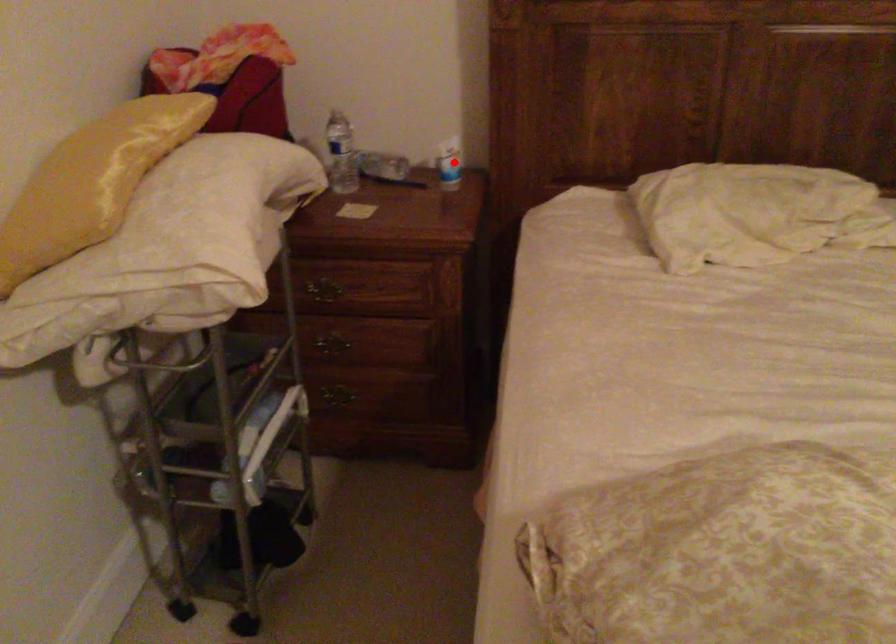
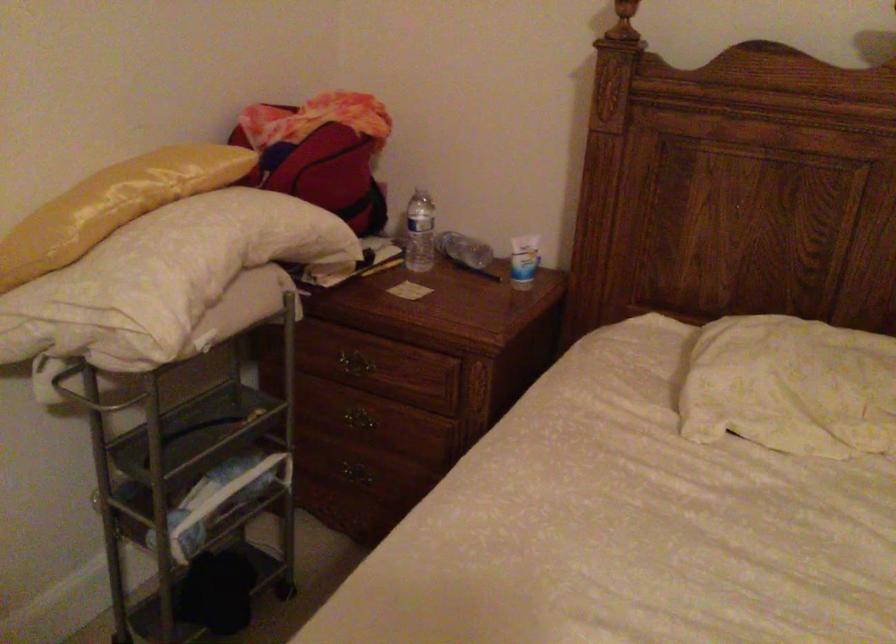
Locate, in the second image, the point that corresponds to the highlighted location in the first image.

(523, 261)